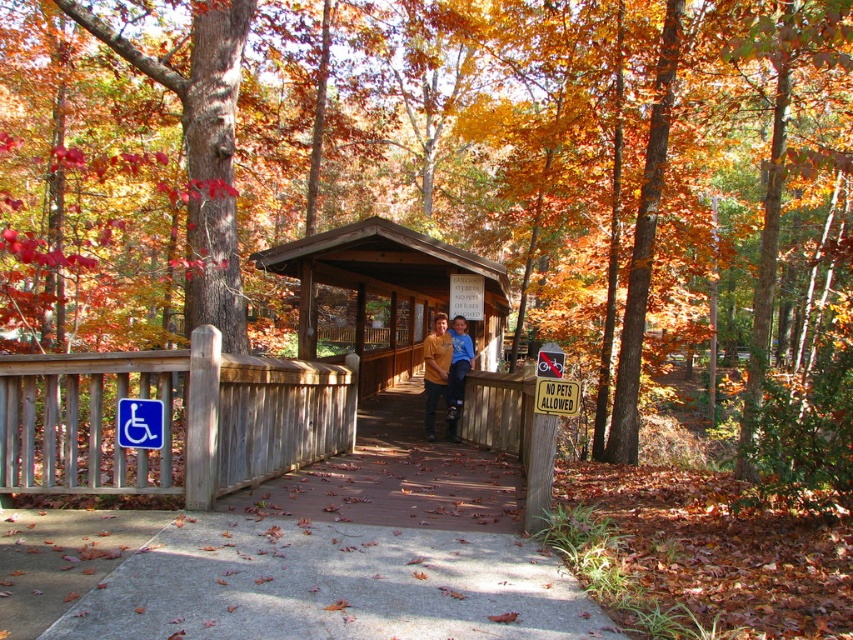
Is brown wooden bridge at center shorter than matte yellow shirt at center?

Yes, brown wooden bridge at center is shorter than matte yellow shirt at center.

Is point (376, 513) positioned behind point (451, 433)?

No, (376, 513) is in front of (451, 433).

The image size is (853, 640). Identify the location of brown wooden bridge at center. (350, 554).

Between point (445, 557) and point (138, 406), which one is positioned behind?

The point (138, 406) is behind.

Is brown wooden bridge at center wider than blue plastic wheelchair symbol at center?

Yes, brown wooden bridge at center is wider than blue plastic wheelchair symbol at center.

Describe the element at coordinates (350, 554) in the screenshot. The height and width of the screenshot is (640, 853). I see `brown wooden bridge at center` at that location.

What are the coordinates of `brown wooden bridge at center` in the screenshot? It's located at (350, 554).

Locate an element on the screen. This screenshot has height=640, width=853. brown wooden bridge at center is located at coordinates (350, 554).

The image size is (853, 640). What do you see at coordinates (350, 554) in the screenshot?
I see `brown wooden bridge at center` at bounding box center [350, 554].

Locate an element on the screen. brown wooden bridge at center is located at coordinates coord(350,554).